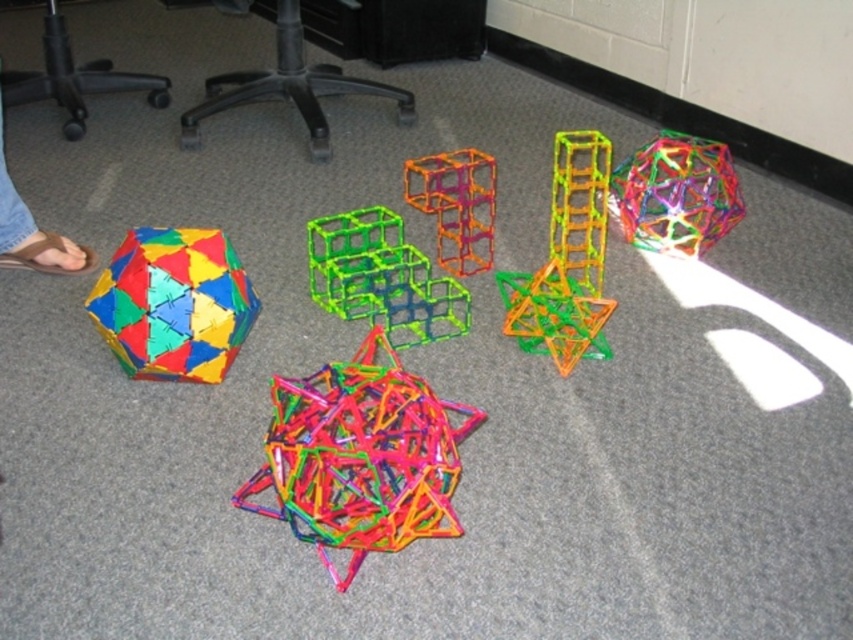
Question: Which object is positioned closest to the translucent plastic star at center?

Choices:
 (A) translucent green plastic star at center
 (B) translucent green plastic cube at center
 (C) translucent multicolored sphere at center

Answer: (B)

Question: Which point appears farthest from the camera in this image?

Choices:
 (A) 416,273
 (B) 212,368

Answer: (A)

Question: Does translucent orange plastic cube at center have a larger size compared to brown leather sandals at lower left?

Choices:
 (A) no
 (B) yes

Answer: (B)

Question: Which point is farther to the camera?

Choices:
 (A) translucent green plastic star at center
 (B) translucent orange plastic cube at center
 (C) translucent multicolored sphere at center
 (D) translucent orange cube at center

Answer: (C)

Question: Does multicolored plastic dodecahedron at lower left appear over translucent orange plastic cube at center?

Choices:
 (A) no
 (B) yes

Answer: (A)

Question: Can you confirm if multicolored plastic dodecahedron at lower left is positioned below translucent green plastic cube at center?

Choices:
 (A) yes
 (B) no

Answer: (A)